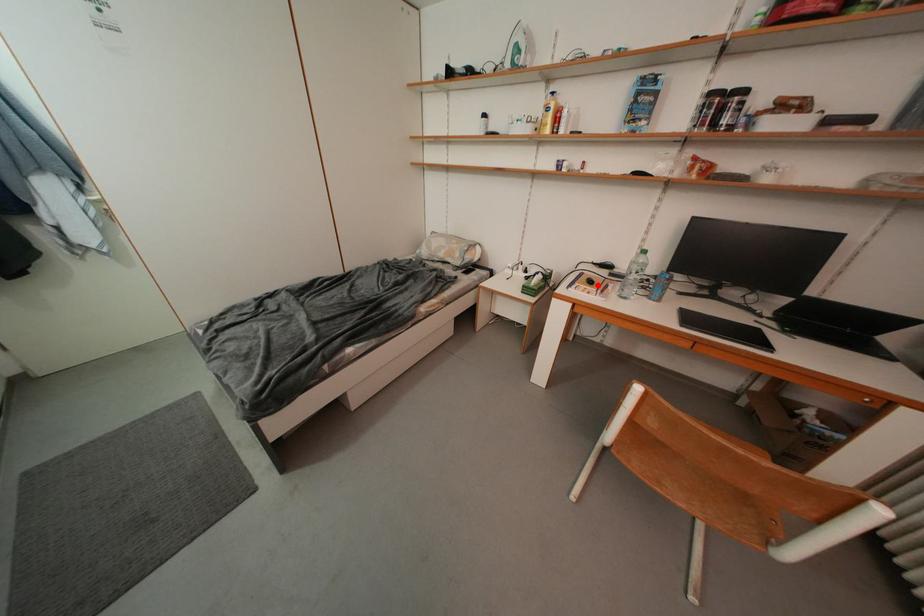
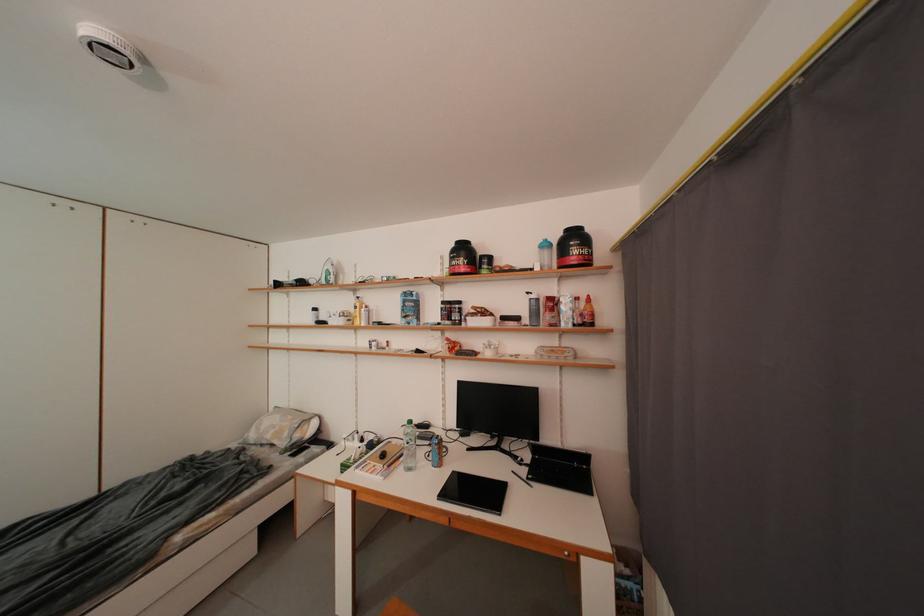
In the second image, find the point that corresponds to the highlighted location in the first image.

(391, 459)